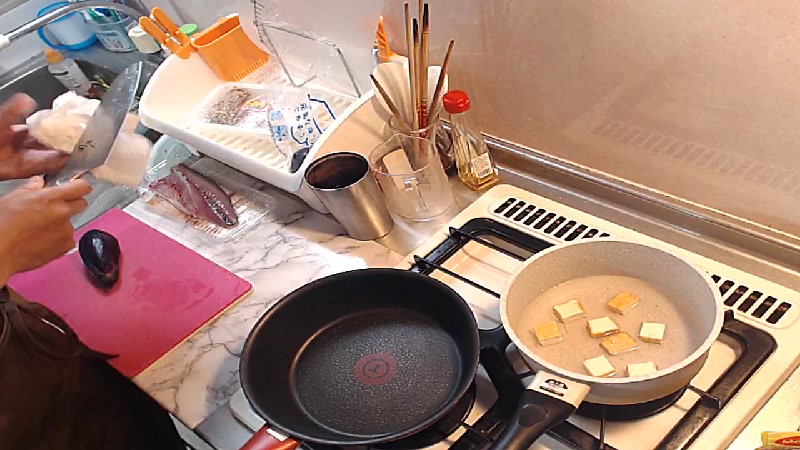
Locate an element on the screen. The width and height of the screenshot is (800, 450). white tray is located at coordinates (238, 158).